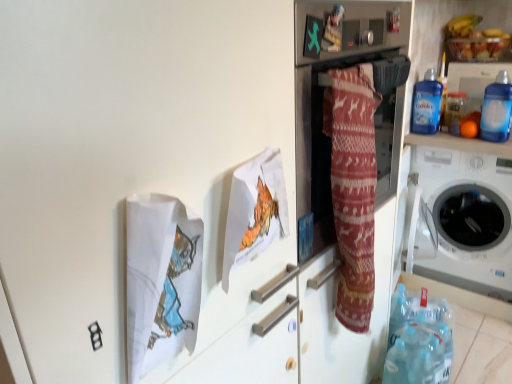
Question: Is the depth of orange matte at upper right less than that of blue plastic bottle at upper right, marked as the third bottle in a back-to-front arrangement?

Choices:
 (A) no
 (B) yes

Answer: (A)

Question: From the image's perspective, does orange matte at upper right appear lower than blue plastic bottle at upper right, which appears as the 2th bottle when viewed from the front?

Choices:
 (A) no
 (B) yes

Answer: (B)

Question: From a real-world perspective, is orange matte at upper right below blue plastic bottle at upper right, marked as the third bottle in a back-to-front arrangement?

Choices:
 (A) no
 (B) yes

Answer: (B)

Question: Is orange matte at upper right far away from blue plastic bottle at upper right, which appears as the 2th bottle when viewed from the front?

Choices:
 (A) no
 (B) yes

Answer: (A)

Question: Does orange matte at upper right have a greater width compared to blue plastic bottle at upper right, marked as the third bottle in a back-to-front arrangement?

Choices:
 (A) no
 (B) yes

Answer: (B)

Question: Considering the positions of transparent plastic bottle at upper right, the third bottle from the front, and white plastic washing machine at right in the image, is transparent plastic bottle at upper right, the third bottle from the front, bigger or smaller than white plastic washing machine at right?

Choices:
 (A) small
 (B) big

Answer: (A)

Question: Visually, is transparent plastic bottle at upper right, the third bottle from the front, positioned to the left or to the right of white plastic washing machine at right?

Choices:
 (A) right
 (B) left

Answer: (B)

Question: From a real-world perspective, is transparent plastic bottle at upper right, the 2th bottle in the back-to-front sequence, physically located above or below white plastic washing machine at right?

Choices:
 (A) below
 (B) above

Answer: (B)

Question: Considering the positions of point (451, 102) and point (480, 210), is point (451, 102) closer or farther from the camera than point (480, 210)?

Choices:
 (A) closer
 (B) farther

Answer: (A)

Question: In terms of width, does transparent plastic bottle at upper right, the 2th bottle in the back-to-front sequence, look wider or thinner when compared to patterned fabric at center?

Choices:
 (A) thin
 (B) wide

Answer: (A)

Question: From the image's perspective, is transparent plastic bottle at upper right, the 2th bottle in the back-to-front sequence, located above or below patterned fabric at center?

Choices:
 (A) below
 (B) above

Answer: (B)

Question: Considering the positions of point (453, 97) and point (327, 61), is point (453, 97) closer or farther from the camera than point (327, 61)?

Choices:
 (A) closer
 (B) farther

Answer: (B)

Question: In the image, is transparent plastic bottle at upper right, the 2th bottle in the back-to-front sequence, on the left side or the right side of patterned fabric at center?

Choices:
 (A) right
 (B) left

Answer: (A)

Question: Is orange matte at upper right taller or shorter than blue plastic bottle at upper right, which appears as the 2th bottle when viewed from the front?

Choices:
 (A) tall
 (B) short

Answer: (B)

Question: From the image's perspective, relative to blue plastic bottle at upper right, marked as the third bottle in a back-to-front arrangement, is orange matte at upper right above or below?

Choices:
 (A) below
 (B) above

Answer: (A)